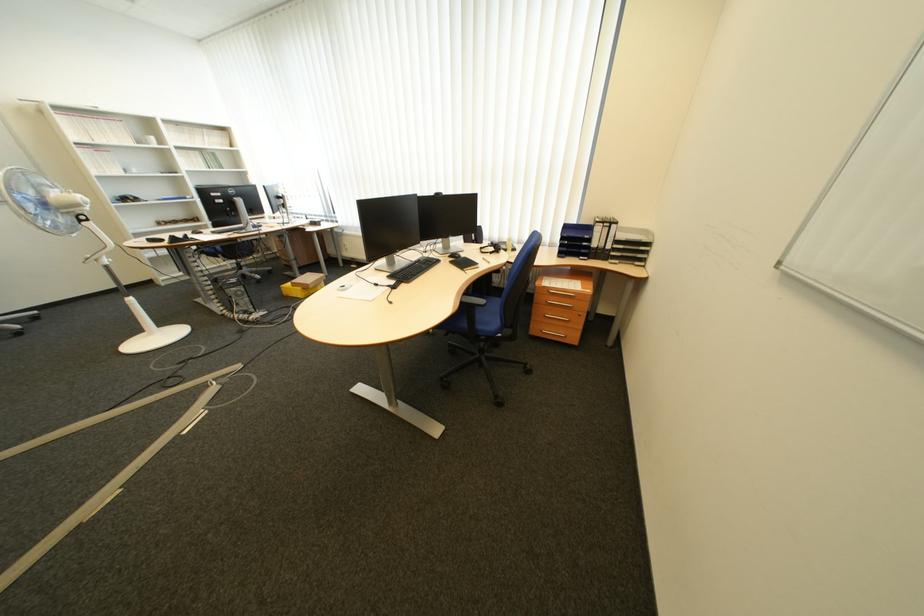
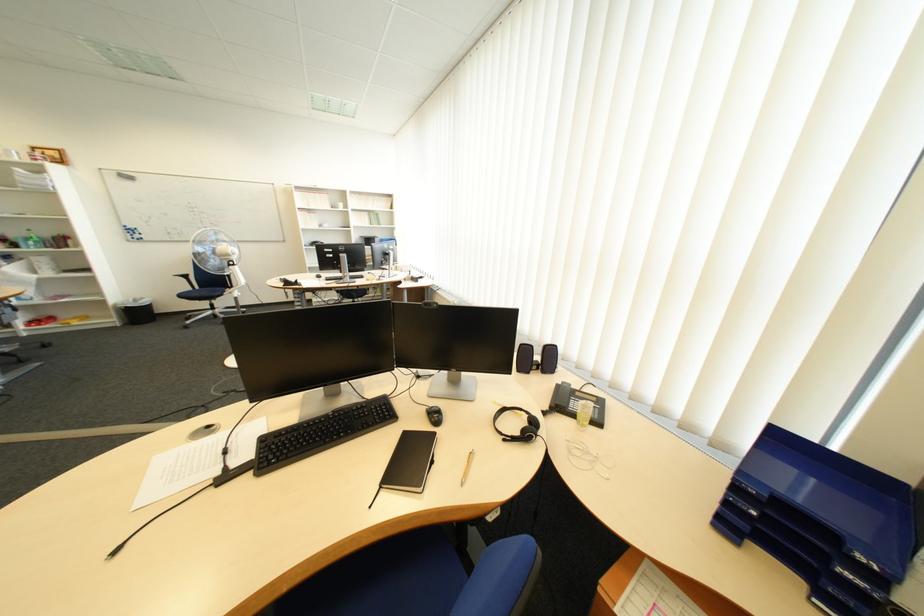
In the second image, find the point that corresponds to (494,249) in the first image.

(517, 411)